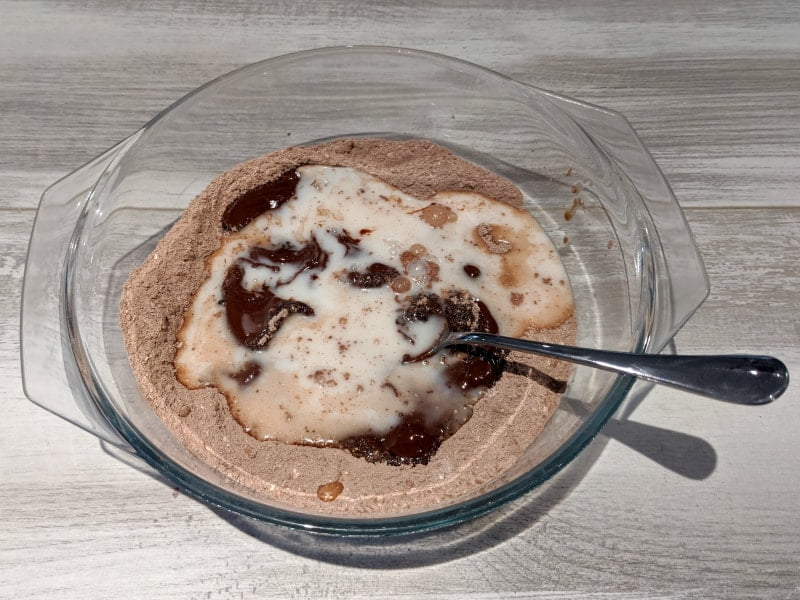
The image size is (800, 600). Find the location of `glass handle`. glass handle is located at coordinates (50, 217), (626, 163).